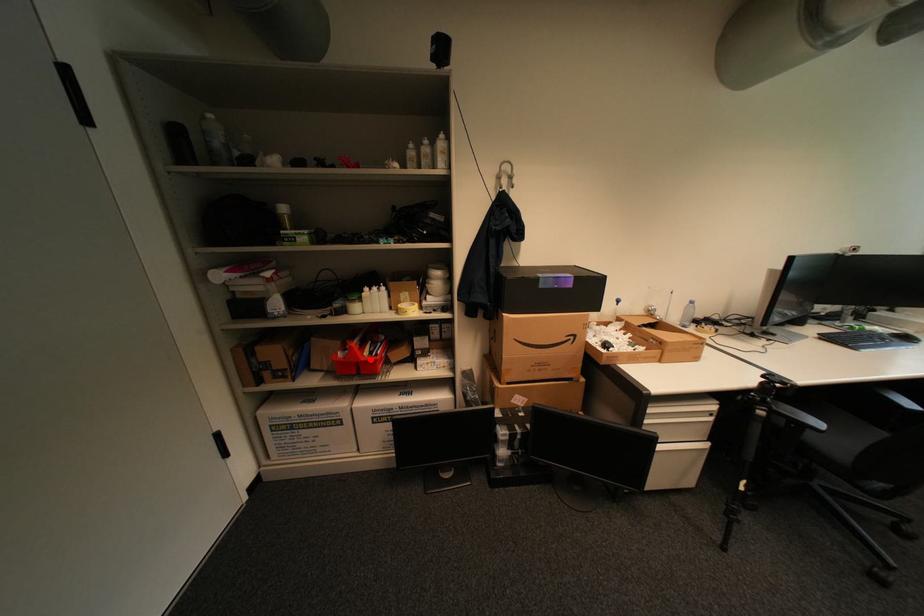
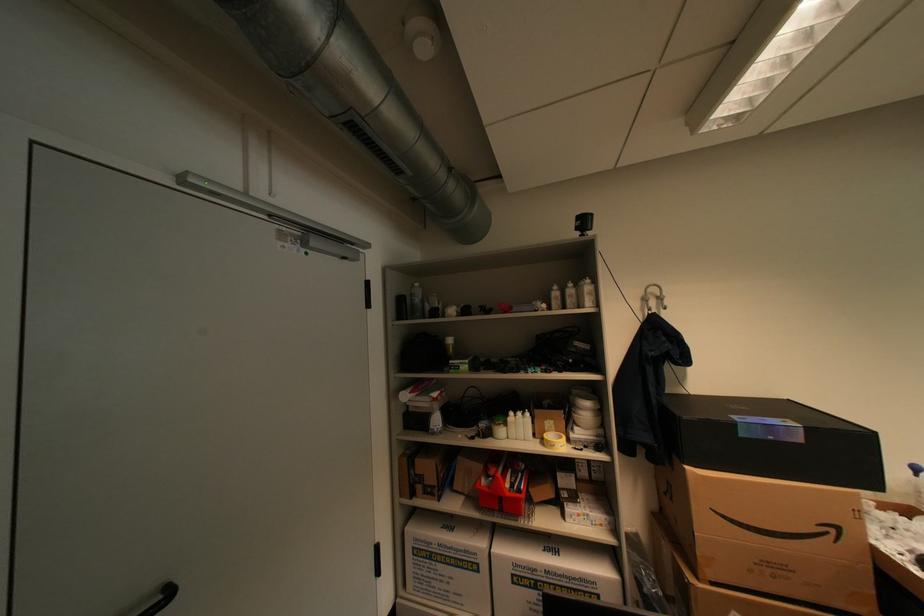
The point at the highlighted location is marked in the first image. Where is the corresponding point in the second image?

(516, 495)